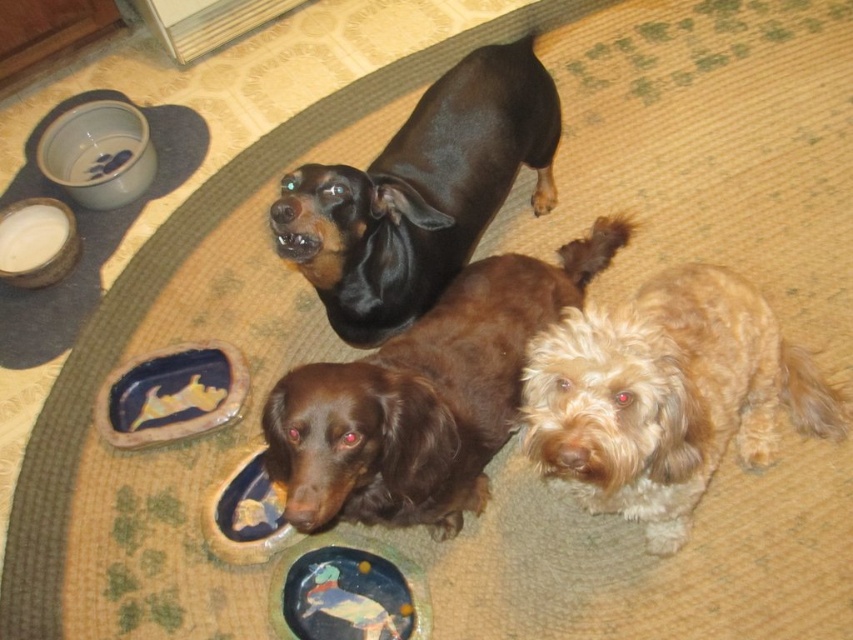
Question: Considering the real-world distances, which object is closest to the black shiny coat at upper center?

Choices:
 (A) matte ceramic platter at lower center
 (B) white glossy bowl at upper left
 (C) matte ceramic platter at center
 (D) blue ceramic bowl at lower center

Answer: (C)

Question: Is brown shaggy dog at center positioned at the back of black shiny coat at upper center?

Choices:
 (A) no
 (B) yes

Answer: (A)

Question: Does matte ceramic platter at center have a smaller size compared to blue ceramic bowl at lower center?

Choices:
 (A) no
 (B) yes

Answer: (A)

Question: Which is farther from the blue ceramic bowl at lower center?

Choices:
 (A) brown shaggy dog at center
 (B) fuzzy light brown dog at lower right

Answer: (B)

Question: Is brown shaggy dog at center to the right of blue ceramic bowl at lower center from the viewer's perspective?

Choices:
 (A) no
 (B) yes

Answer: (B)

Question: Which of the following is the closest to the observer?

Choices:
 (A) (51, 264)
 (B) (242, 490)

Answer: (B)